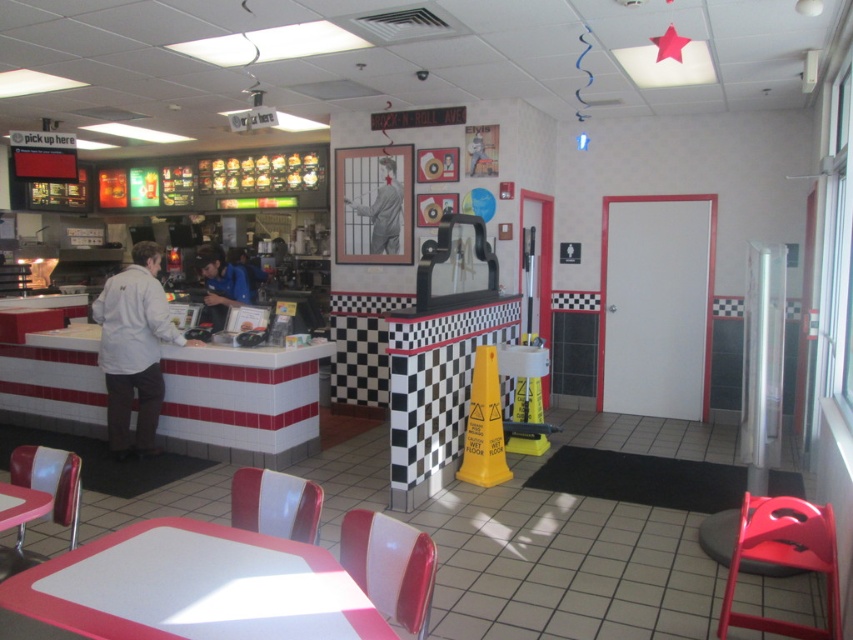
Question: Does matte red chair at lower right appear over matte plastic chair at lower left?

Choices:
 (A) no
 (B) yes

Answer: (A)

Question: Is white glossy table at lower center positioned before matte white table at lower left?

Choices:
 (A) no
 (B) yes

Answer: (B)

Question: Which point appears closest to the camera in this image?

Choices:
 (A) (51, 508)
 (B) (44, 467)

Answer: (A)

Question: Which is nearer to the matte white table at lower left?

Choices:
 (A) gray matte mannequin at center
 (B) matte plastic chair at lower left

Answer: (B)

Question: Which object is the farthest from the white glossy table at lower center?

Choices:
 (A) gray matte mannequin at center
 (B) matte red chair at lower right
 (C) blue fabric shirt at center

Answer: (C)

Question: Can you confirm if white matte jacket at left is positioned above matte white table at lower left?

Choices:
 (A) yes
 (B) no

Answer: (A)